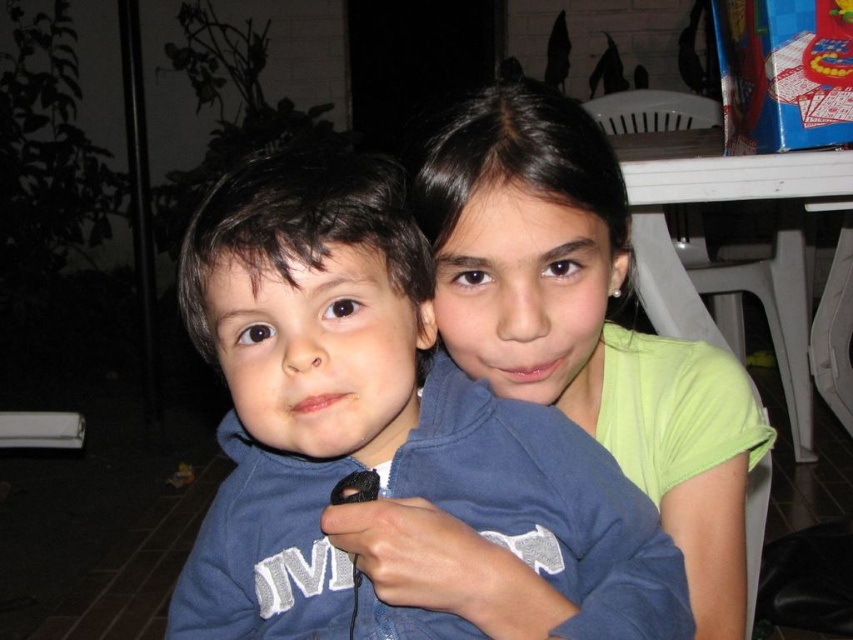
Can you confirm if blue fleece jacket at center is positioned below light green fabric shirt at upper right?

Correct, blue fleece jacket at center is located below light green fabric shirt at upper right.

Is blue fleece jacket at center positioned before light green fabric shirt at upper right?

Yes.

Where is `blue fleece jacket at center`? The height and width of the screenshot is (640, 853). blue fleece jacket at center is located at coordinates (376, 419).